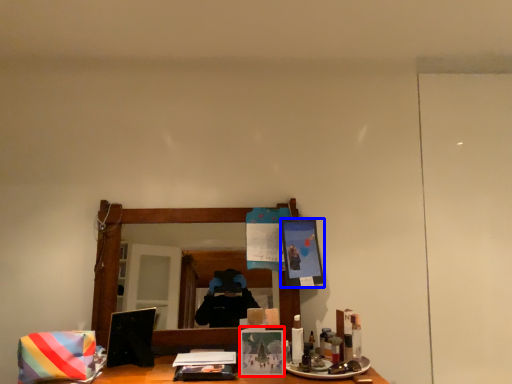
Question: Which of the following is the closest to the observer, picture frame (highlighted by a red box) or picture frame (highlighted by a blue box)?

Choices:
 (A) picture frame
 (B) picture frame

Answer: (A)